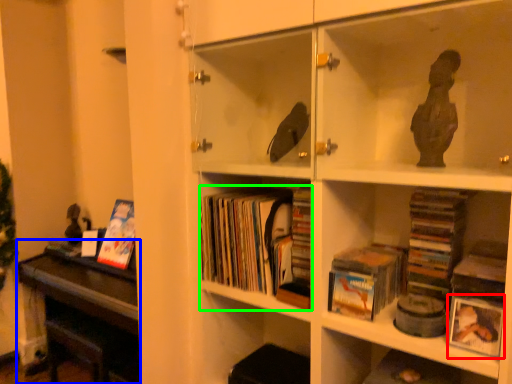
Question: Based on their relative distances, which object is nearer to paperback book (highlighted by a red box)? Choose from table (highlighted by a blue box) and book (highlighted by a green box).

Choices:
 (A) table
 (B) book

Answer: (B)